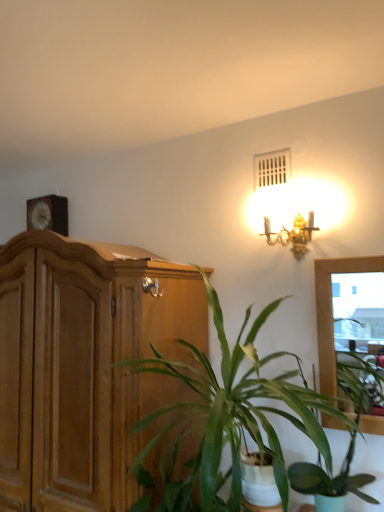
Question: Is gold metallic sconce at upper right inside the boundaries of wooden clock at upper left, or outside?

Choices:
 (A) inside
 (B) outside

Answer: (B)

Question: From the image's perspective, relative to wooden clock at upper left, is gold metallic sconce at upper right above or below?

Choices:
 (A) below
 (B) above

Answer: (A)

Question: Which is farther from the green leafy plant at center, the 1th houseplant positioned from the right?

Choices:
 (A) gold metallic sconce at upper right
 (B) wooden cabinet at left
 (C) green leafy plant at center, the 1th houseplant when ordered from left to right
 (D) wooden clock at upper left

Answer: (D)

Question: Based on their relative distances, which object is nearer to the wooden cabinet at left?

Choices:
 (A) green leafy plant at center, the 1th houseplant positioned from the right
 (B) green leafy plant at center, marked as the second houseplant in a right-to-left arrangement
 (C) wooden clock at upper left
 (D) gold metallic sconce at upper right

Answer: (B)